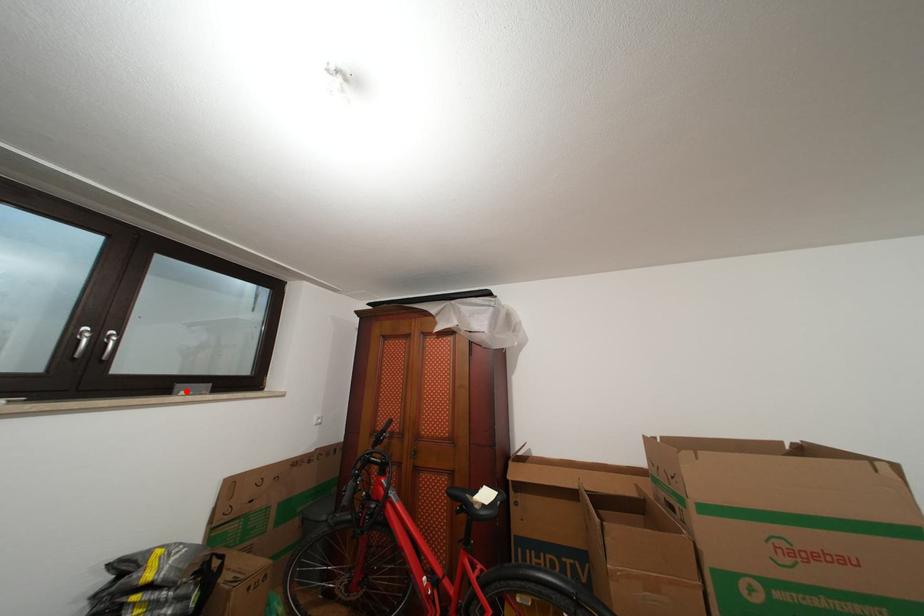
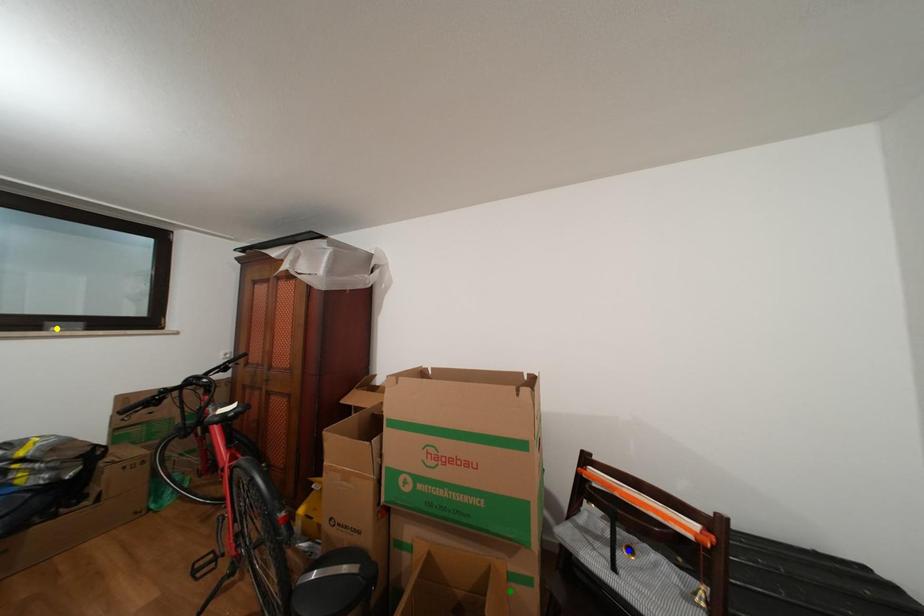
Question: I am providing you with two images of the same scene from different viewpoints. A red point is marked on the first image. You are given multiple points on the second image. Can you choose the point in image 2 that corresponds to the point in image 1?

Choices:
 (A) blue point
 (B) yellow point
 (C) green point

Answer: (B)